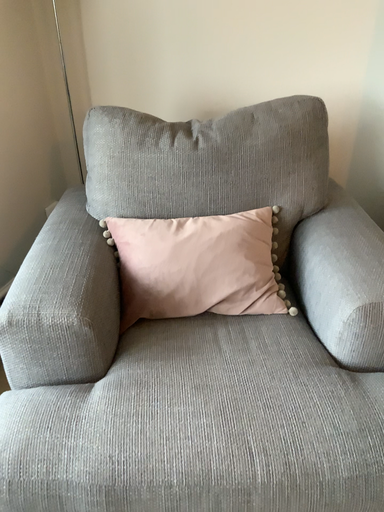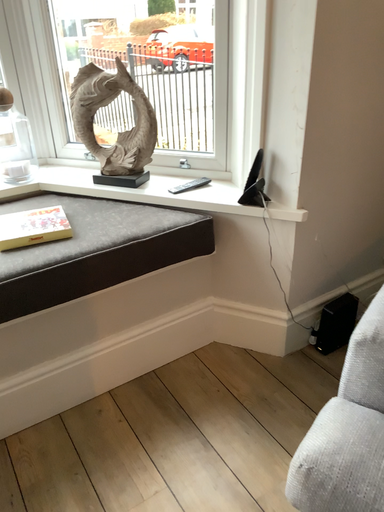
Question: Which way did the camera rotate in the video?

Choices:
 (A) rotated left
 (B) rotated right

Answer: (A)